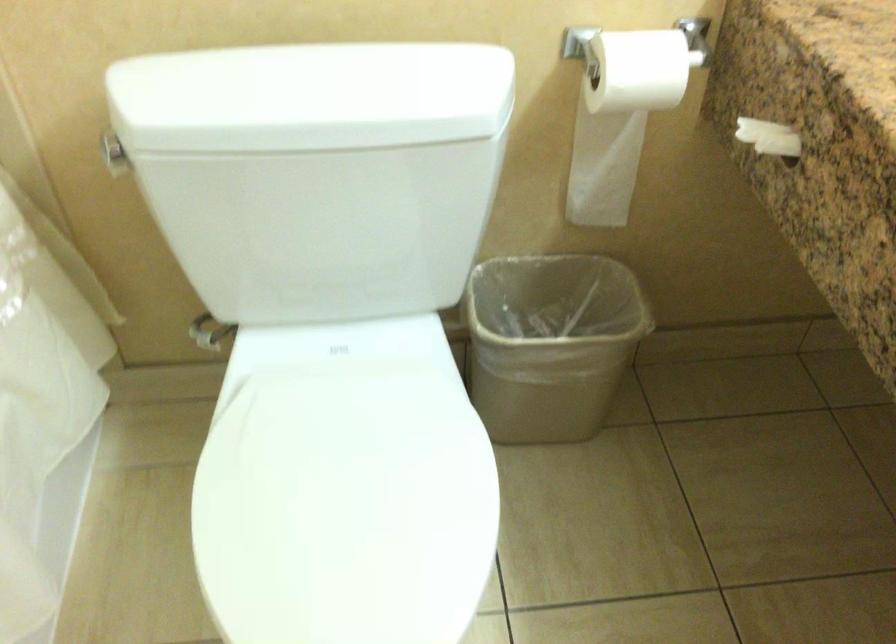
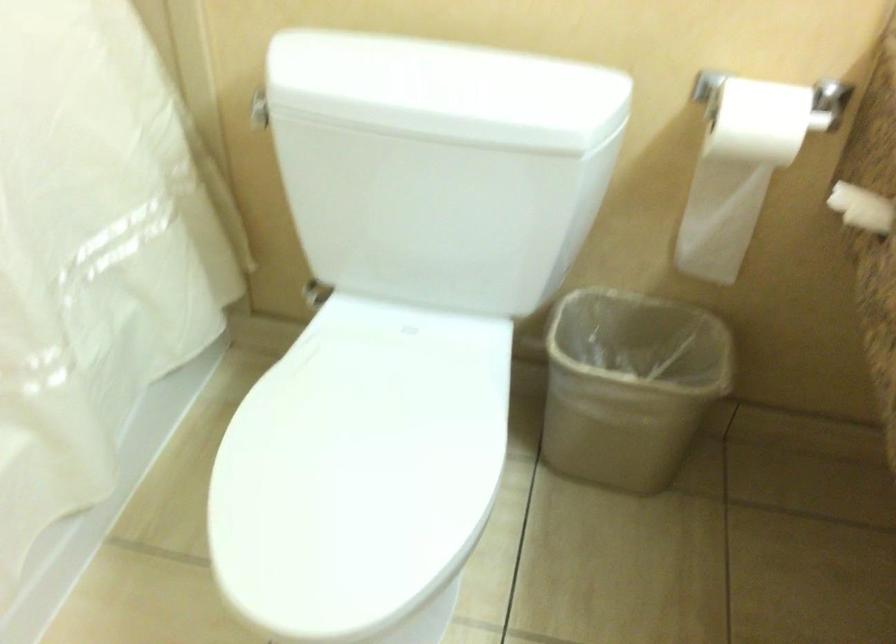
The point at [332,93] is marked in the first image. Where is the corresponding point in the second image?

(446, 90)